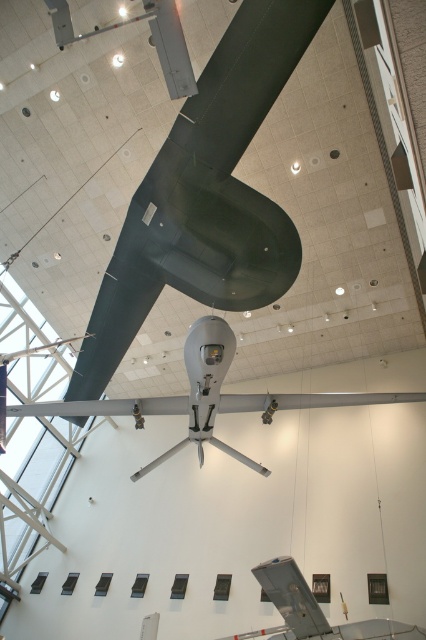
Consider the image. You are a museum visitor standing at the entrance of the exhibition hall. You see the silver metallic drone at center and the metallic gray airplane at lower center. How far apart are these two exhibits from each other?

The distance between the silver metallic drone at center and the metallic gray airplane at lower center is 3.76 meters.

You are standing in the museum and want to take a photo of the drone. The camera you are using has a focal length of 50mm and a sensor size of 36mm. If you want to capture the entire drone in your photo without cropping, what is the minimum distance you need to be from the point at point (213, 388)?

The point at point (213, 388) is 5.92 meters away from the viewer. To capture the entire drone in the photo without cropping, you need to be at least 5.92 meters away from the point at point (213, 388).

You are a visitor at the museum and want to take a photo of both the silver metallic drone at center and the metallic gray airplane at lower center. Which object should you focus on first to ensure both are in the frame?

You should focus on the silver metallic drone at center first since it is closer to you than the metallic gray airplane at lower center, ensuring both are in the frame by adjusting the camera angle accordingly.